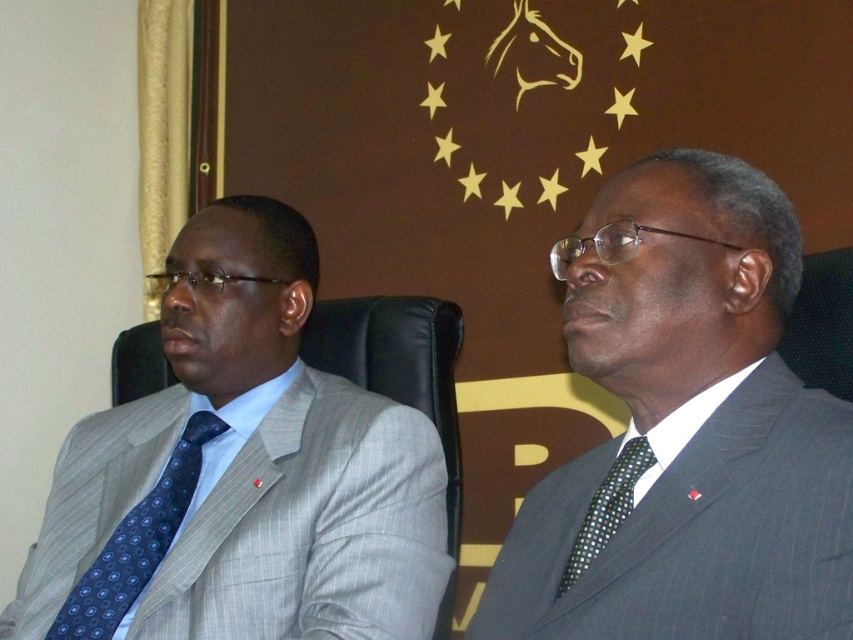
Can you confirm if gray pinstripe suit at left is wider than black dotted tie at right?

Indeed, gray pinstripe suit at left has a greater width compared to black dotted tie at right.

Does gray pinstripe suit at left appear on the left side of black dotted tie at right?

Indeed, gray pinstripe suit at left is positioned on the left side of black dotted tie at right.

Locate an element on the screen. The height and width of the screenshot is (640, 853). gray pinstripe suit at left is located at coordinates pos(241,474).

Can you confirm if dark gray pinstripe suit at right is shorter than black dotted tie at right?

Incorrect, dark gray pinstripe suit at right's height does not fall short of black dotted tie at right's.

Who is more forward, (695, 365) or (602, 529)?

Point (695, 365)

I want to click on dark gray pinstripe suit at right, so click(x=685, y=429).

Does dark gray pinstripe suit at right have a greater height compared to gray pinstripe suit at left?

Incorrect, dark gray pinstripe suit at right's height is not larger of gray pinstripe suit at left's.

Is point (674, 401) behind point (300, 296)?

No, it is in front of (300, 296).

What are the coordinates of `dark gray pinstripe suit at right` in the screenshot? It's located at (685, 429).